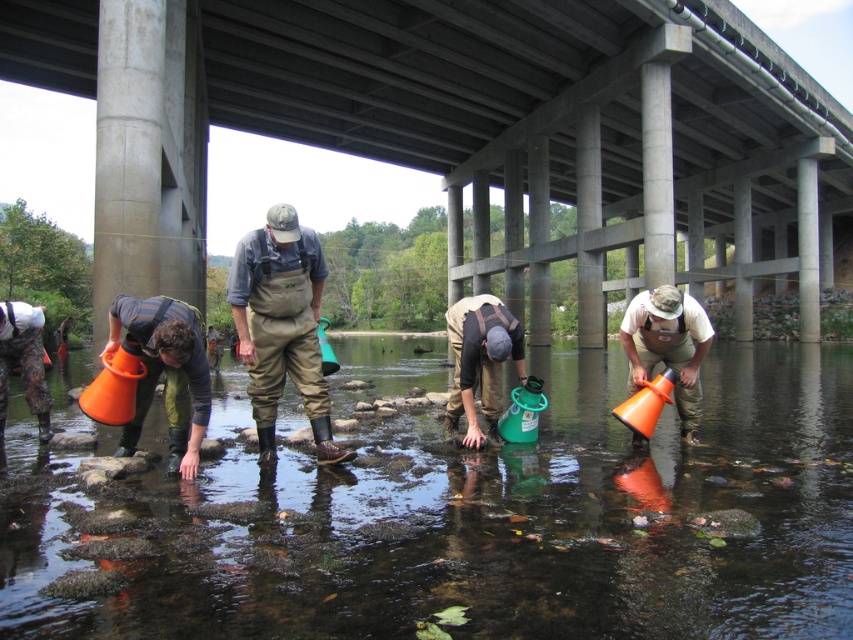
You are a member of the team conducting water sampling under the bridge. You need to place a new container that is taller than the orange plastic bucket at lower left but shorter than the matte orange cone at center right. Which object can you use as a reference to ensure the container fits between them?

The orange plastic bucket at lower left is shorter than the matte orange cone at center right. You can use the matte orange cone at center right as a reference to ensure the new container is shorter than it and taller than the orange plastic bucket at lower left.

You are a member of the team conducting water sampling under the bridge. You need to retrieve a sample from the orange plastic bucket at lower left and place it into the matte orange cone at center right. Can you directly move the sample from the bucket to the cone without moving any objects in between?

The orange plastic bucket at lower left is in front of the matte orange cone at center right, so you can directly move the sample from the orange plastic bucket at lower left to the matte orange cone at center right without needing to move any objects in between.